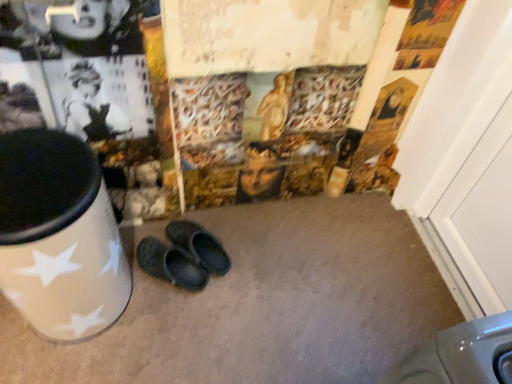
Question: In the image, is white glossy waste container at left on the left side or the right side of white wood door at right?

Choices:
 (A) left
 (B) right

Answer: (A)

Question: Which is correct: white glossy waste container at left is inside white wood door at right, or outside of it?

Choices:
 (A) outside
 (B) inside

Answer: (A)

Question: Estimate the real-world distances between objects in this image. Which object is farther from the black rubber clogs at center?

Choices:
 (A) white glossy waste container at left
 (B) white wood door at right

Answer: (B)

Question: Which of these objects is positioned closest to the black rubber clogs at center?

Choices:
 (A) white wood door at right
 (B) white glossy waste container at left

Answer: (B)